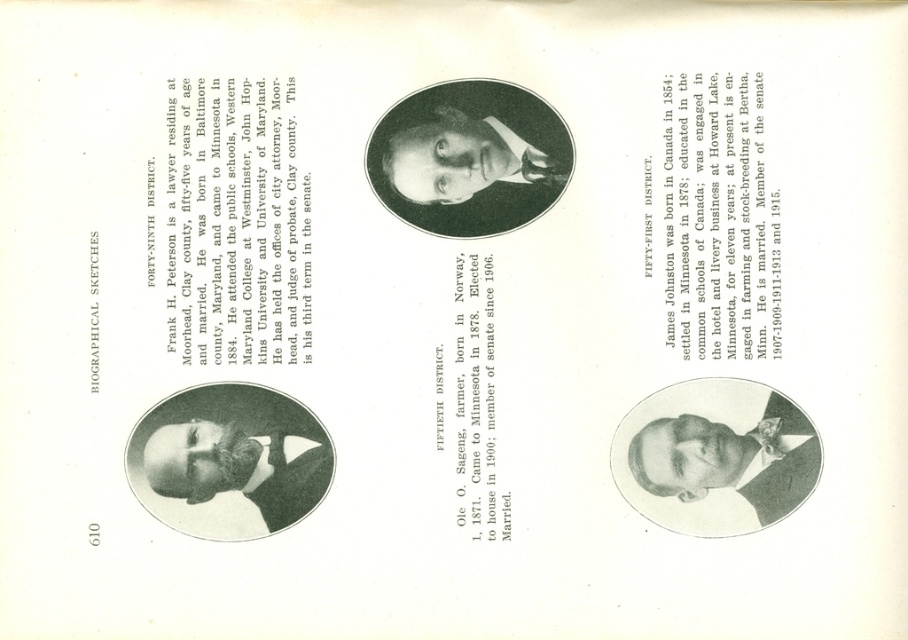
Based on the photo, you are designing a layout for Frank H. Peterson. The black paper text at center needs to be placed below the black matte portrait at center. Can the text fit horizontally if the text is narrower than the portrait?

The black paper text at center is narrower than the black matte portrait at center, so it can fit horizontally below the portrait.

You are designing a layout for a biographical sketchbook page and need to place a smooth black suit at lower right and black paper text at center. Considering their widths, which object should you place first to ensure proper alignment?

The smooth black suit at lower right might be wider than black paper text at center, so you should place the smooth black suit at lower right first to account for its potential width and ensure proper alignment.